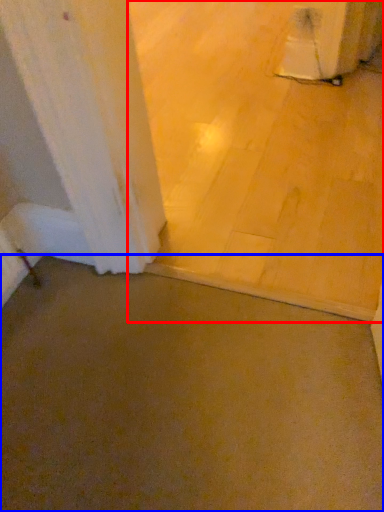
Question: Which object appears closest to the camera in this image, concrete (highlighted by a red box) or concrete (highlighted by a blue box)?

Choices:
 (A) concrete
 (B) concrete

Answer: (B)